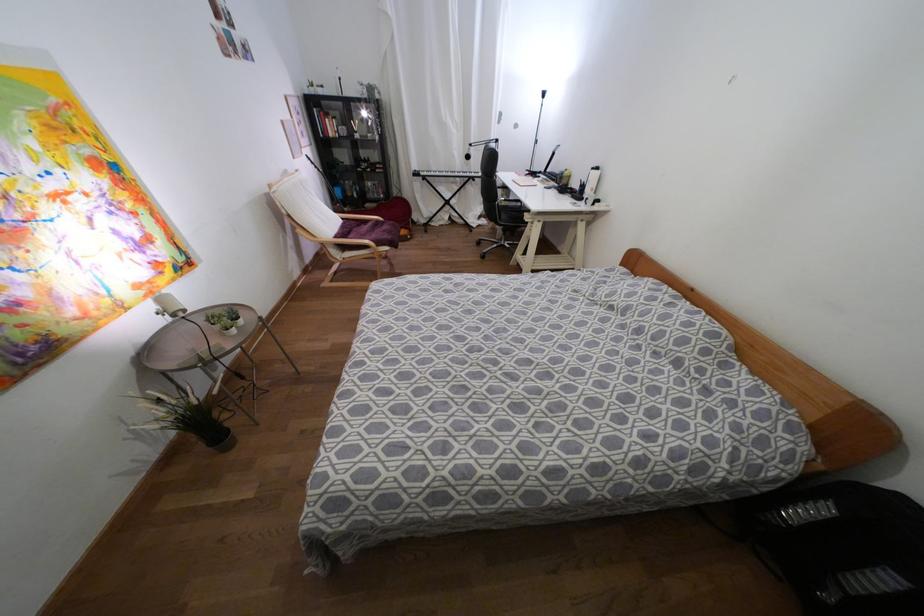
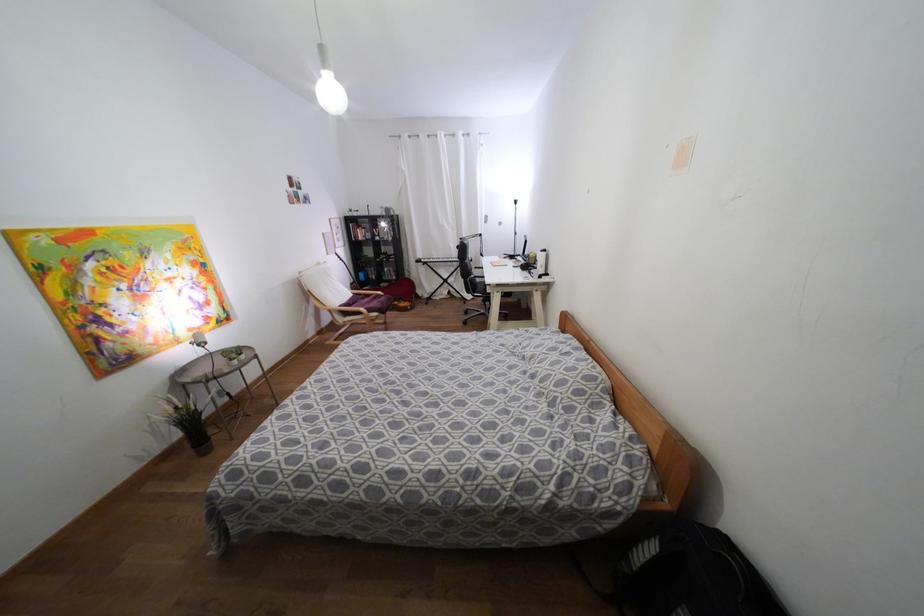
Find the pixel in the second image that matches point 505,199 in the first image.

(475, 276)